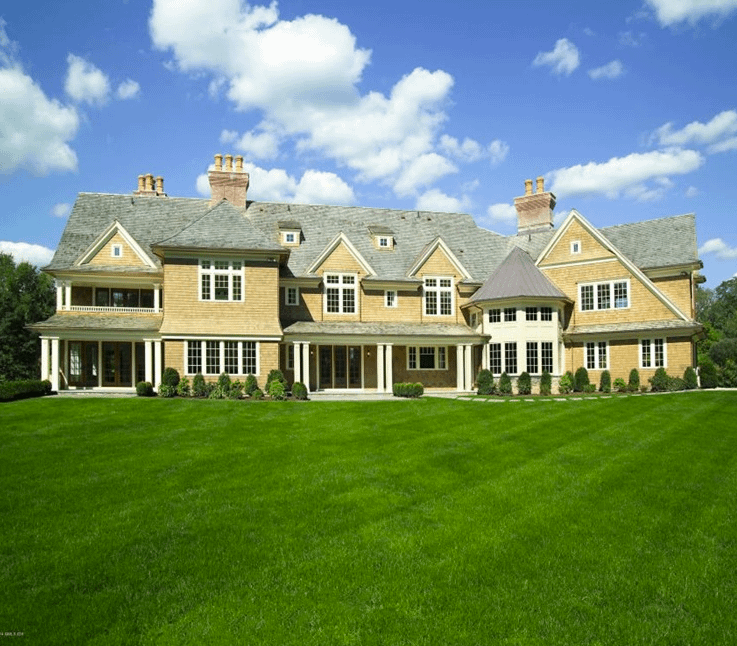
Where is `door`? This screenshot has height=646, width=737. door is located at coordinates (345, 360).